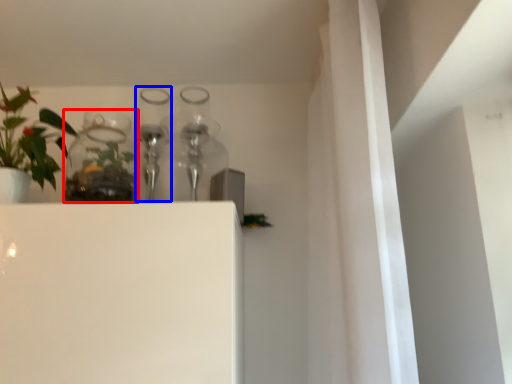
Question: Which object is closer to the camera taking this photo, glass vase (highlighted by a red box) or bottle (highlighted by a blue box)?

Choices:
 (A) glass vase
 (B) bottle

Answer: (A)